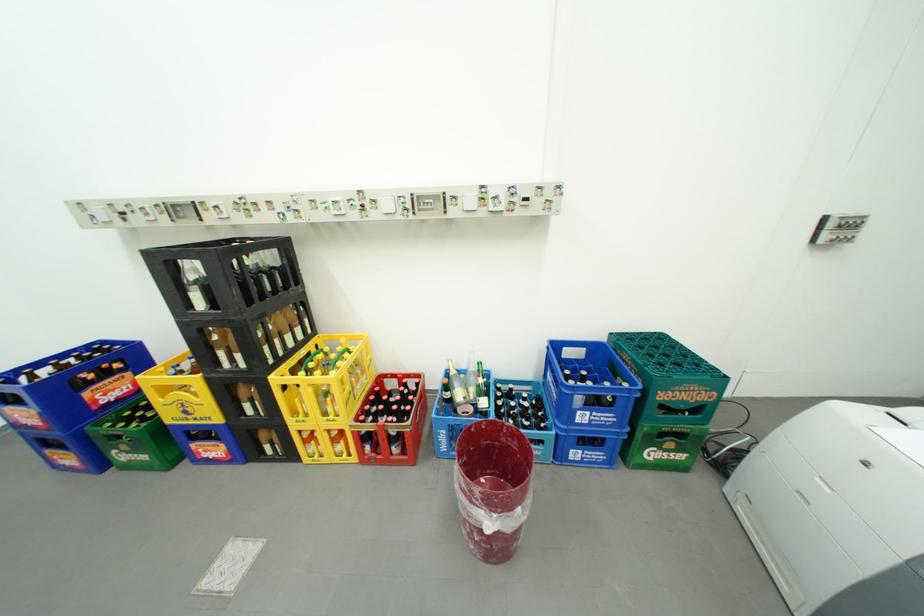
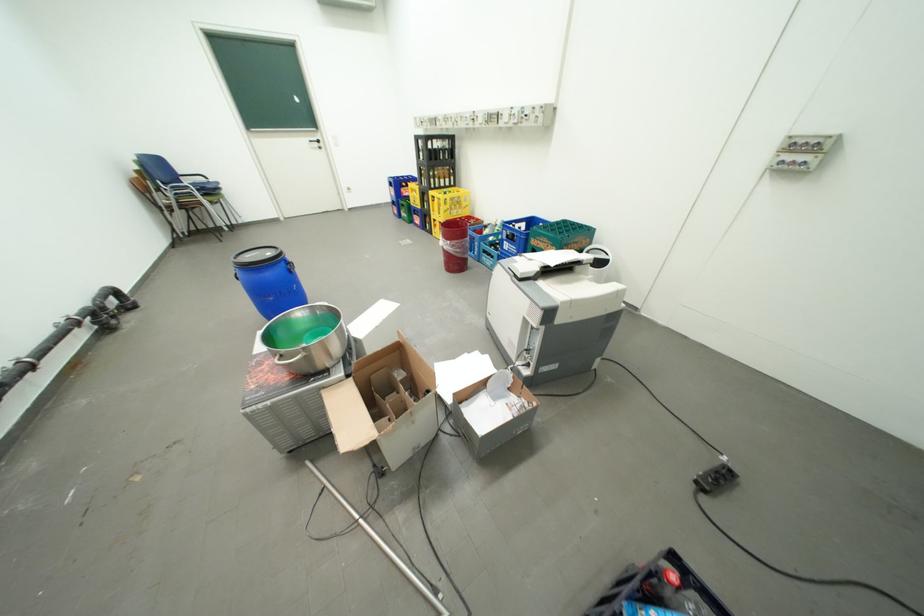
Find the pixel in the second image that matches pixel 716 392 in the first image.

(562, 246)